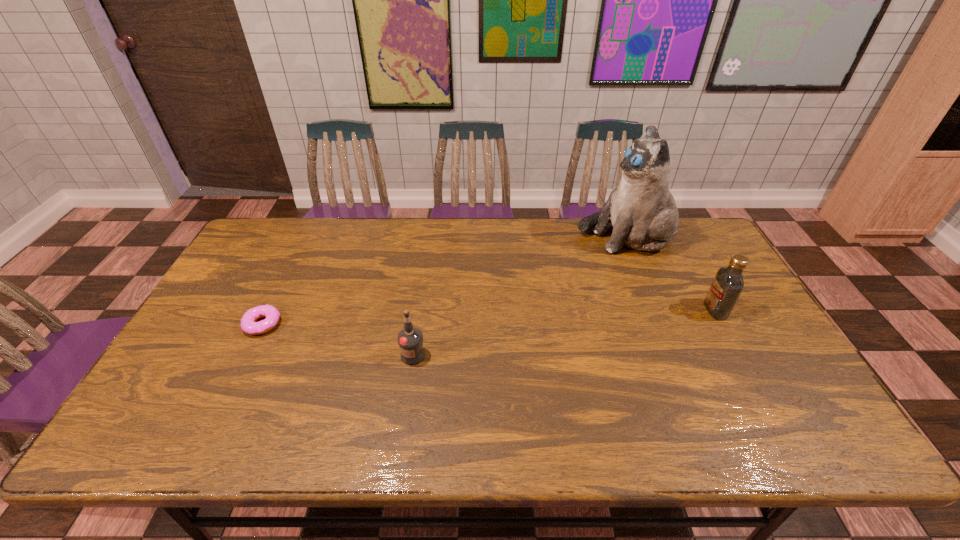
Identify the location of free point between the cat and the shortest object. Image resolution: width=960 pixels, height=540 pixels. (444, 280).

I want to click on unoccupied position between the cat and the leftmost object, so click(444, 280).

I want to click on vacant area that lies between the doughnut and the farthest object, so click(x=444, y=280).

Where is `free space between the doughnut and the left vodka`? free space between the doughnut and the left vodka is located at coordinates (338, 340).

Locate an element on the screen. This screenshot has width=960, height=540. free point between the farther vodka and the tallest object is located at coordinates (670, 273).

The height and width of the screenshot is (540, 960). Identify the location of free space between the farthest object and the farther vodka. (670, 273).

I want to click on object that is the closest one to the farther vodka, so click(x=641, y=208).

Locate which object is the second closest to the farther vodka. Please provide its 2D coordinates. Your answer should be formatted as a tuple, i.e. [(x, y)], where the tuple contains the x and y coordinates of a point satisfying the conditions above.

[(410, 339)]

This screenshot has height=540, width=960. I want to click on free location that satisfies the following two spatial constraints: 1. on the front-facing side of the second tallest object; 2. on the front label of the third object from right to left, so click(740, 355).

At what (x,y) coordinates should I click in order to perform the action: click on vacant space that satisfies the following two spatial constraints: 1. at the face of the farthest object; 2. on the front label of the shorter vodka. Please return your answer as a coordinate pair (x, y). Image resolution: width=960 pixels, height=540 pixels. Looking at the image, I should click on (673, 355).